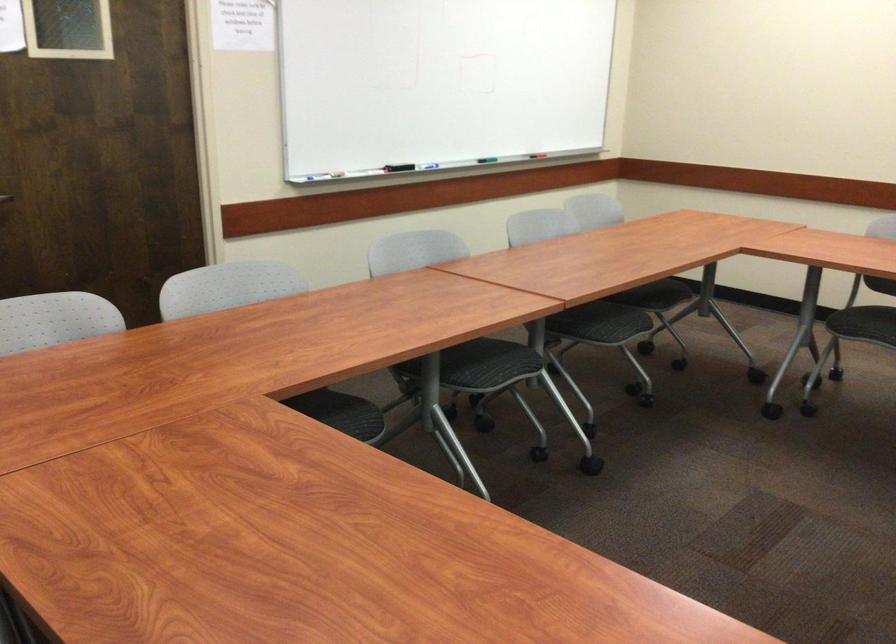
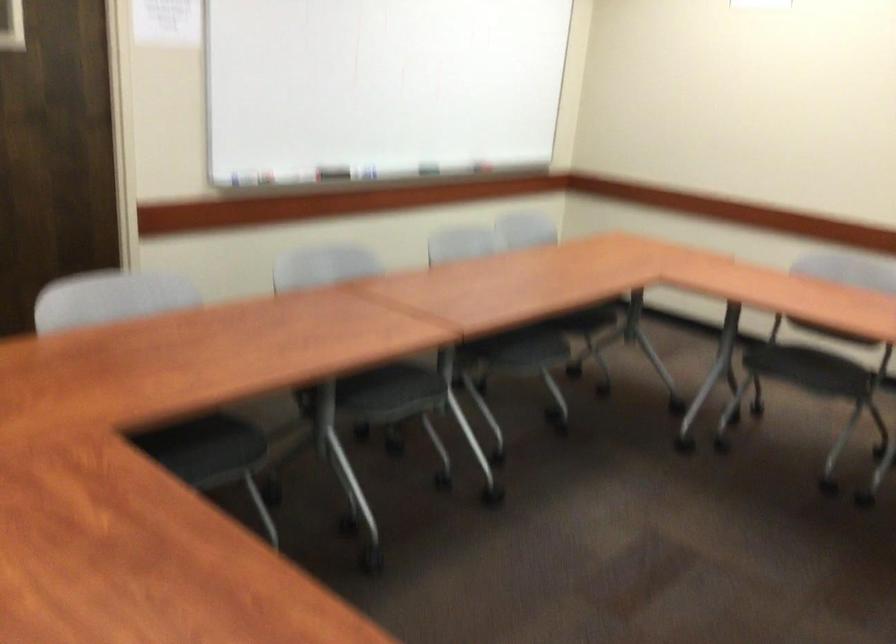
Question: How did the camera likely rotate?

Choices:
 (A) Left
 (B) Right
 (C) Up
 (D) Down

Answer: (B)